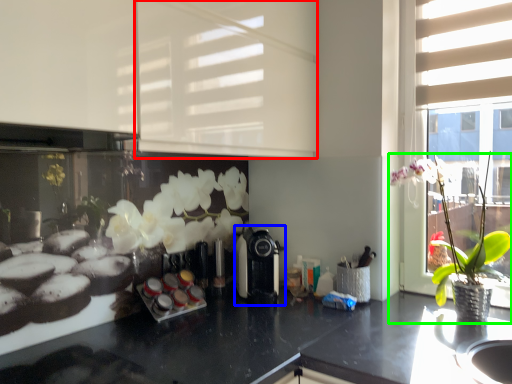
Question: Estimate the real-world distances between objects in this image. Which object is farther from shutter (highlighted by a red box), coffee machine (highlighted by a blue box) or houseplant (highlighted by a green box)?

Choices:
 (A) coffee machine
 (B) houseplant

Answer: (B)